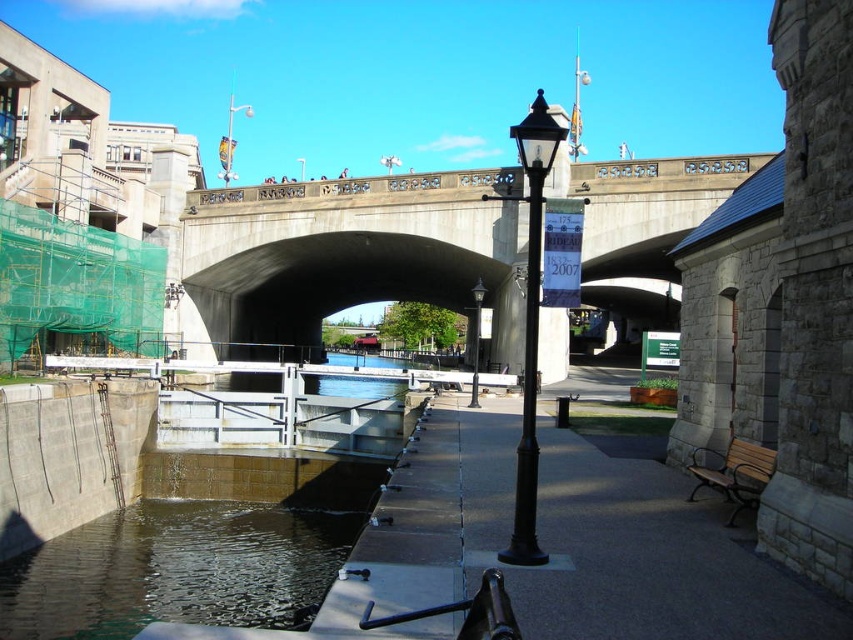
Question: Observing the image, what is the correct spatial positioning of black metal streetlight at center in reference to black metal lamp post at center?

Choices:
 (A) above
 (B) below

Answer: (A)

Question: Can you confirm if smooth concrete pavement at center is positioned above concrete bridge at center?

Choices:
 (A) no
 (B) yes

Answer: (A)

Question: Which point appears closest to the camera in this image?

Choices:
 (A) (477, 392)
 (B) (656, 561)
 (C) (498, 196)
 (D) (379, 234)

Answer: (B)

Question: Which point appears closest to the camera in this image?

Choices:
 (A) (473, 364)
 (B) (520, 456)
 (C) (532, 324)

Answer: (C)

Question: Which point appears farthest from the camera in this image?

Choices:
 (A) (521, 426)
 (B) (521, 554)
 (C) (585, 218)
 (D) (479, 332)

Answer: (C)

Question: Can you confirm if concrete bridge at center is bigger than black metal streetlight at center?

Choices:
 (A) no
 (B) yes

Answer: (A)